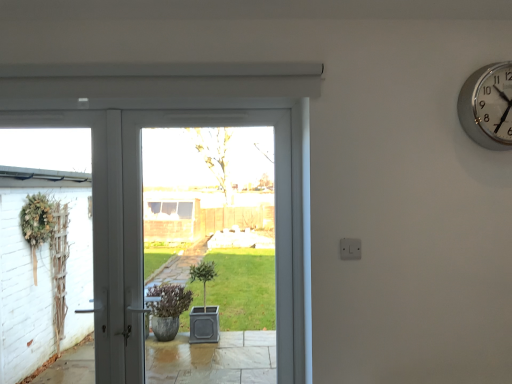
What is the approximate width of white glossy door at center?

10.33 centimeters.

You are a GUI agent. You are given a task and a screenshot of the screen. Output one action in this format:
    pyautogui.click(x=<x>, y=<y>)
    Task: Click on the white glossy door at center
    
    Given the screenshot: What is the action you would take?
    pos(142,227)

The width and height of the screenshot is (512, 384). Describe the element at coordinates (142, 227) in the screenshot. I see `white glossy door at center` at that location.

Measure the distance between point (140, 204) and camera.

A distance of 2.01 meters exists between point (140, 204) and camera.

Where is `silver metallic wall clock at upper right`? silver metallic wall clock at upper right is located at coordinates (488, 106).

What do you see at coordinates (488, 106) in the screenshot?
I see `silver metallic wall clock at upper right` at bounding box center [488, 106].

The width and height of the screenshot is (512, 384). I want to click on white glossy door at center, so click(x=142, y=227).

Considering the relative positions of white glossy door at center and silver metallic wall clock at upper right in the image provided, is white glossy door at center to the right of silver metallic wall clock at upper right from the viewer's perspective?

No.

Is white glossy door at center further to camera compared to silver metallic wall clock at upper right?

Yes, white glossy door at center is further from the viewer.

Is point (124, 172) positioned before point (490, 84)?

No, (124, 172) is behind (490, 84).

From the image's perspective, is white glossy door at center located above silver metallic wall clock at upper right?

No.

From a real-world perspective, which is physically below, white glossy door at center or silver metallic wall clock at upper right?

In real-world perspective, white glossy door at center is lower.

Which object is wider, white glossy door at center or silver metallic wall clock at upper right?

white glossy door at center is wider.

In terms of height, does white glossy door at center look taller or shorter compared to silver metallic wall clock at upper right?

white glossy door at center is taller than silver metallic wall clock at upper right.

Considering the sizes of objects white glossy door at center and silver metallic wall clock at upper right in the image provided, who is bigger, white glossy door at center or silver metallic wall clock at upper right?

Bigger between the two is white glossy door at center.

Is white glossy door at center inside the boundaries of silver metallic wall clock at upper right, or outside?

white glossy door at center is outside silver metallic wall clock at upper right.

Would you consider white glossy door at center to be distant from silver metallic wall clock at upper right?

That's right, there is a large distance between white glossy door at center and silver metallic wall clock at upper right.

Could you tell me if white glossy door at center is facing silver metallic wall clock at upper right?

No, white glossy door at center does not turn towards silver metallic wall clock at upper right.

Measure the distance from white glossy door at center to silver metallic wall clock at upper right.

white glossy door at center and silver metallic wall clock at upper right are 3.69 feet apart from each other.

Identify the location of door on the left of silver metallic wall clock at upper right. pyautogui.click(x=142, y=227).

In the image, is silver metallic wall clock at upper right on the left side or the right side of white glossy door at center?

From the image, it's evident that silver metallic wall clock at upper right is to the right of white glossy door at center.

Between silver metallic wall clock at upper right and white glossy door at center, which one is positioned behind?

white glossy door at center is more distant.

Between point (483, 124) and point (129, 308), which one is positioned in front?

Positioned in front is point (483, 124).

From the image's perspective, which object appears higher, silver metallic wall clock at upper right or white glossy door at center?

silver metallic wall clock at upper right appears higher in the image.

From a real-world perspective, is silver metallic wall clock at upper right physically below white glossy door at center?

No.

Between silver metallic wall clock at upper right and white glossy door at center, which one has larger width?

white glossy door at center is wider.

Does silver metallic wall clock at upper right have a lesser height compared to white glossy door at center?

Indeed, silver metallic wall clock at upper right has a lesser height compared to white glossy door at center.

Who is smaller, silver metallic wall clock at upper right or white glossy door at center?

Smaller between the two is silver metallic wall clock at upper right.

Is silver metallic wall clock at upper right surrounding white glossy door at center?

Definitely not — white glossy door at center is not inside silver metallic wall clock at upper right.

Is silver metallic wall clock at upper right not near white glossy door at center?

Absolutely, silver metallic wall clock at upper right is distant from white glossy door at center.

Is white glossy door at center at the back of silver metallic wall clock at upper right?

silver metallic wall clock at upper right does not have its back to white glossy door at center.

What's the angular difference between silver metallic wall clock at upper right and white glossy door at center's facing directions?

0.417 degrees separate the facing orientations of silver metallic wall clock at upper right and white glossy door at center.

Find the location of a particular element. The height and width of the screenshot is (384, 512). wall clock that appears in front of the white glossy door at center is located at coordinates coord(488,106).

This screenshot has width=512, height=384. What are the coordinates of `wall clock located on the right of white glossy door at center` in the screenshot? It's located at coord(488,106).

Locate an element on the screen. This screenshot has width=512, height=384. door behind the silver metallic wall clock at upper right is located at coordinates (142, 227).